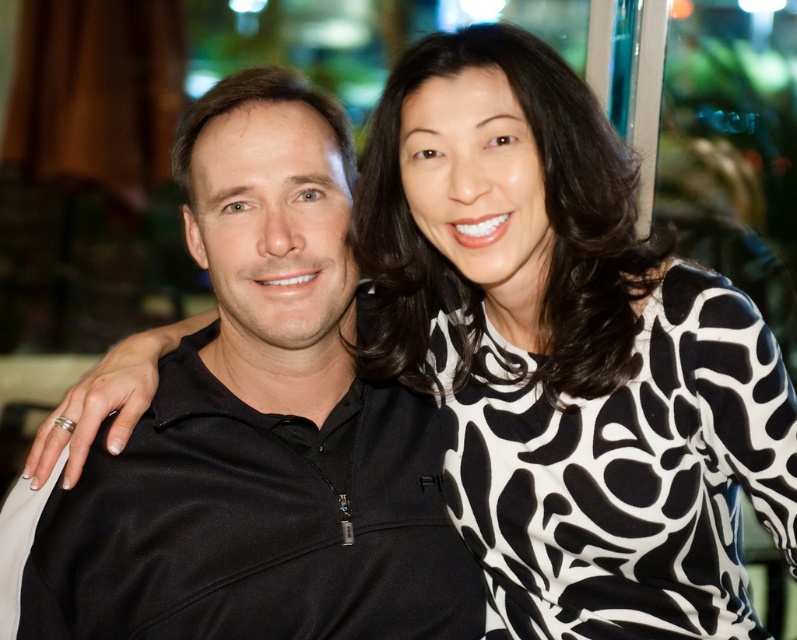
Between point (491, 513) and point (285, 529), which one is positioned in front?

Point (491, 513) is more forward.

Based on the photo, between black and white printed blouse at upper right and black matte jacket at center, which one has less height?

black and white printed blouse at upper right is shorter.

Who is more forward, (527, 209) or (152, 561)?

Point (527, 209) is in front.

Identify the location of black and white printed blouse at upper right. The height and width of the screenshot is (640, 797). (571, 358).